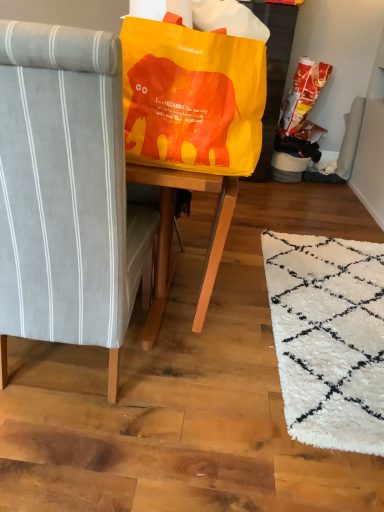
Identify the location of vacant space underneath gray fabric chair at left (from a real-world perspective). The height and width of the screenshot is (512, 384). (58, 369).